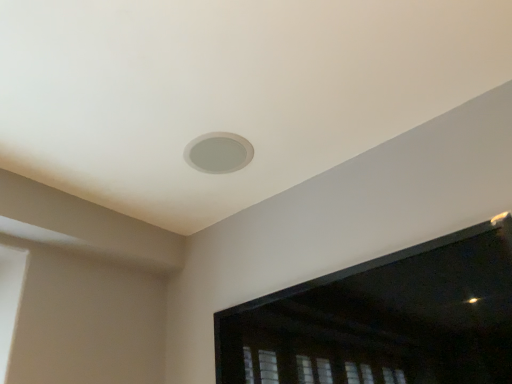
Question: Is transparent plastic window screen at upper center to the right of white matte hole at center from the viewer's perspective?

Choices:
 (A) no
 (B) yes

Answer: (B)

Question: Could you tell me if transparent plastic window screen at upper center is facing white matte hole at center?

Choices:
 (A) no
 (B) yes

Answer: (A)

Question: From a real-world perspective, is transparent plastic window screen at upper center over white matte hole at center?

Choices:
 (A) yes
 (B) no

Answer: (B)

Question: Considering the relative sizes of transparent plastic window screen at upper center and white matte hole at center in the image provided, is transparent plastic window screen at upper center shorter than white matte hole at center?

Choices:
 (A) yes
 (B) no

Answer: (B)

Question: Is transparent plastic window screen at upper center at the left side of white matte hole at center?

Choices:
 (A) yes
 (B) no

Answer: (B)

Question: Is transparent plastic window screen at upper center surrounding white matte hole at center?

Choices:
 (A) no
 (B) yes

Answer: (A)

Question: Is the position of white matte hole at center more distant than that of transparent plastic window screen at upper center?

Choices:
 (A) no
 (B) yes

Answer: (B)

Question: Is white matte hole at center not inside transparent plastic window screen at upper center?

Choices:
 (A) yes
 (B) no

Answer: (A)

Question: Is white matte hole at center positioned in front of transparent plastic window screen at upper center?

Choices:
 (A) no
 (B) yes

Answer: (A)

Question: Can you confirm if white matte hole at center is positioned to the left of transparent plastic window screen at upper center?

Choices:
 (A) no
 (B) yes

Answer: (B)

Question: Does white matte hole at center have a greater width compared to transparent plastic window screen at upper center?

Choices:
 (A) no
 (B) yes

Answer: (B)

Question: Is white matte hole at center positioned far away from transparent plastic window screen at upper center?

Choices:
 (A) yes
 (B) no

Answer: (B)

Question: Considering the positions of point (211, 140) and point (245, 350), is point (211, 140) closer or farther from the camera than point (245, 350)?

Choices:
 (A) closer
 (B) farther

Answer: (A)